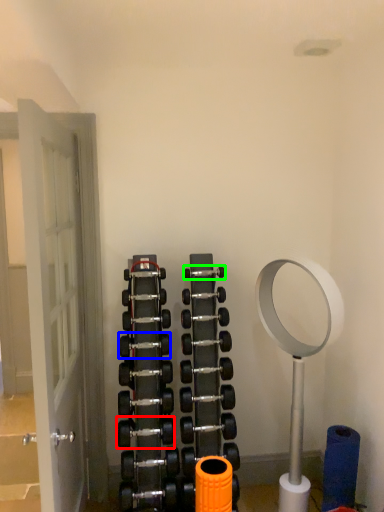
Question: Which object is positioned farthest from dumbbell (highlighted by a red box)? Select from dumbbell (highlighted by a blue box) and dumbbell (highlighted by a green box).

Choices:
 (A) dumbbell
 (B) dumbbell

Answer: (B)